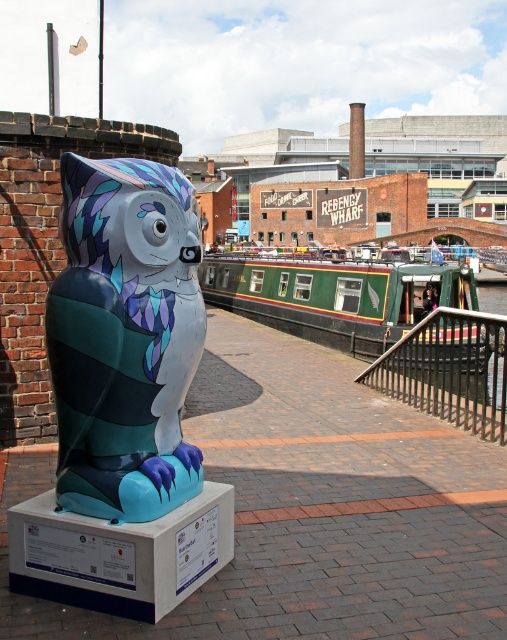
You are an artist planning to paint the scene. You need to decide which object to focus on first based on their sizes. Which object should you paint first, the shiny metallic cat at center or the green polished wood barge at center?

The shiny metallic cat at center has a smaller size compared to the green polished wood barge at center, so you should paint the shiny metallic cat at center first to ensure details are captured accurately before moving to larger elements.